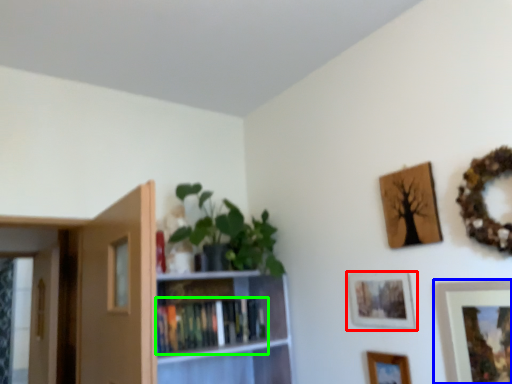
Question: Based on their relative distances, which object is nearer to picture frame (highlighted by a red box)? Choose from picture frame (highlighted by a blue box) and book (highlighted by a green box).

Choices:
 (A) picture frame
 (B) book

Answer: (A)